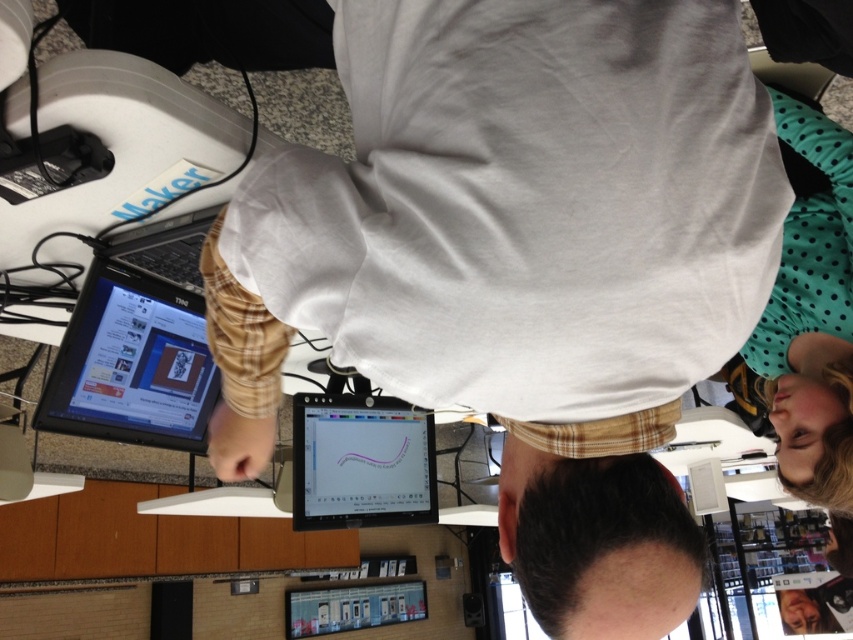
Which is in front, point (695, 260) or point (61, 419)?

Point (695, 260) is in front.

Which is in front, point (605, 193) or point (128, 346)?

Point (605, 193)

Locate an element on the screen. The image size is (853, 640). white cotton shirt at center is located at coordinates (521, 264).

Does black glossy tablet at left appear over matte plastic tablet at center?

Yes, black glossy tablet at left is above matte plastic tablet at center.

Who is higher up, black glossy tablet at left or matte plastic tablet at center?

Positioned higher is black glossy tablet at left.

I want to click on black glossy tablet at left, so click(132, 364).

Where is `black glossy tablet at left`? The image size is (853, 640). black glossy tablet at left is located at coordinates (132, 364).

Who is lower down, white cotton shirt at center or smooth skin face at lower right?

smooth skin face at lower right

Which of these two, white cotton shirt at center or smooth skin face at lower right, stands shorter?

smooth skin face at lower right

Based on the photo, who is more forward, (656, 204) or (780, 592)?

Point (656, 204)

The image size is (853, 640). I want to click on white cotton shirt at center, so click(521, 264).